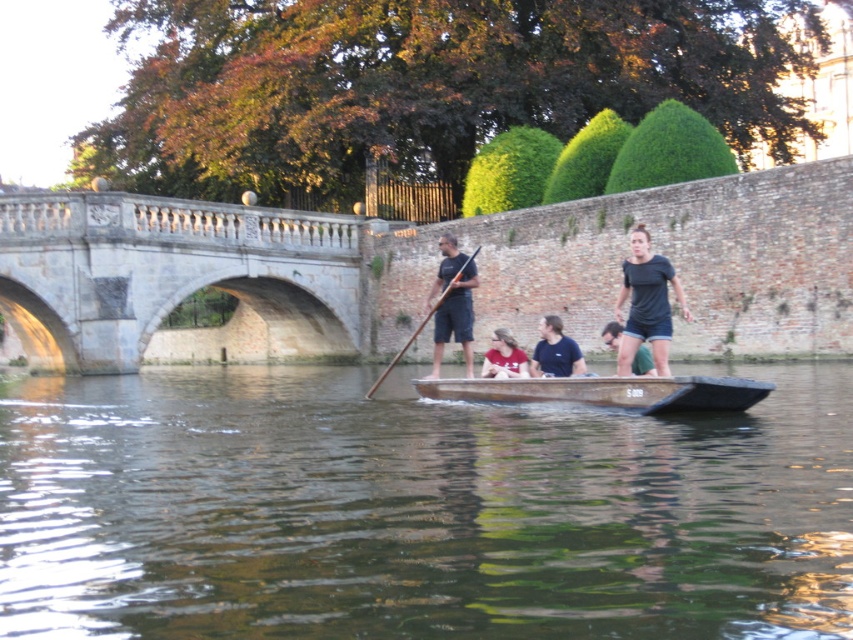
Who is taller, dark blue cotton shirt at center or matte black paddle at center?

With more height is matte black paddle at center.

Who is higher up, dark blue cotton shirt at center or matte black paddle at center?

matte black paddle at center

Is point (637, 316) closer to camera compared to point (436, 371)?

Yes, it is in front of point (436, 371).

What are the coordinates of `dark blue cotton shirt at center` in the screenshot? It's located at (647, 304).

Is matte black paddle at center bigger than brown wooden paddle at center?

Incorrect, matte black paddle at center is not larger than brown wooden paddle at center.

Is matte black paddle at center thinner than brown wooden paddle at center?

Correct, matte black paddle at center's width is less than brown wooden paddle at center's.

The height and width of the screenshot is (640, 853). I want to click on matte black paddle at center, so click(453, 304).

Based on the photo, does wooden canoe at center have a larger size compared to matte black shirt at center?

Yes, wooden canoe at center is bigger than matte black shirt at center.

Who is more distant from viewer, (483, 397) or (637, 353)?

Positioned behind is point (483, 397).

At what (x,y) coordinates should I click in order to perform the action: click on wooden canoe at center. Please return your answer as a coordinate pair (x, y). The image size is (853, 640). Looking at the image, I should click on (607, 392).